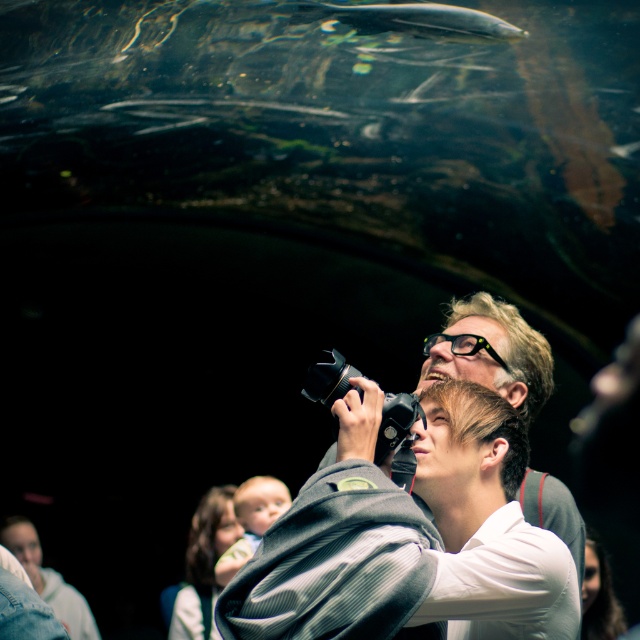
Between point (540, 388) and point (404, 13), which one is positioned in front?

Point (540, 388)

Between matte gray jacket at center and silvery smooth fish at upper center, which one has more height?

With more height is matte gray jacket at center.

Does point (572, 538) come in front of point (326, 17)?

Yes, it is in front of point (326, 17).

In order to click on matte gray jacket at center in this screenshot , I will do `click(410, 538)`.